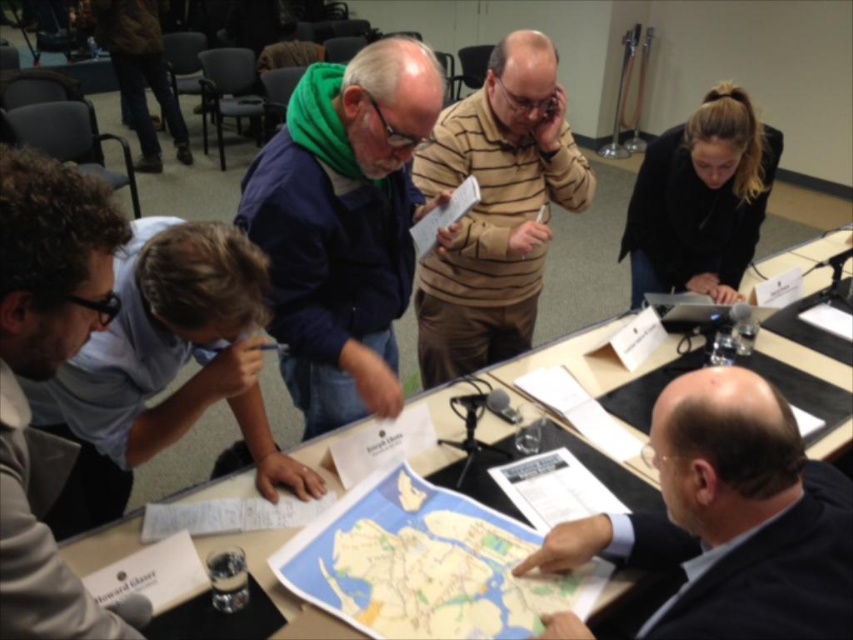
In the scene shown: Can you confirm if dark suit jacket at lower right is shorter than black plastic table at center?

Indeed, dark suit jacket at lower right has a lesser height compared to black plastic table at center.

Does dark suit jacket at lower right have a lesser width compared to black plastic table at center?

Correct, dark suit jacket at lower right's width is less than black plastic table at center's.

You are a GUI agent. You are given a task and a screenshot of the screen. Output one action in this format:
    pyautogui.click(x=<x>, y=<y>)
    Task: Click on the dark suit jacket at lower right
    The width and height of the screenshot is (853, 640).
    Given the screenshot: What is the action you would take?
    pyautogui.click(x=729, y=518)

Does point (207, 228) come closer to viewer compared to point (28, 492)?

That is False.

The image size is (853, 640). What are the coordinates of `blue shirt at lower left` in the screenshot? It's located at (164, 368).

Who is higher up, striped cotton shirt at center or black matte jacket at upper right?

black matte jacket at upper right is above.

Between point (428, 346) and point (717, 269), which one is positioned in front?

Point (428, 346)

The image size is (853, 640). I want to click on striped cotton shirt at center, so click(x=495, y=209).